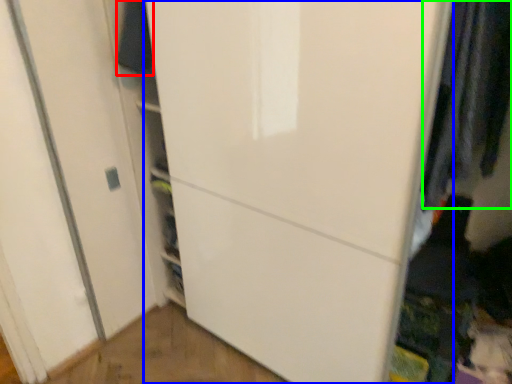
Question: Considering the real-world distances, which object is farthest from clothing (highlighted by a red box)? door (highlighted by a blue box) or clothing (highlighted by a green box)?

Choices:
 (A) door
 (B) clothing

Answer: (B)